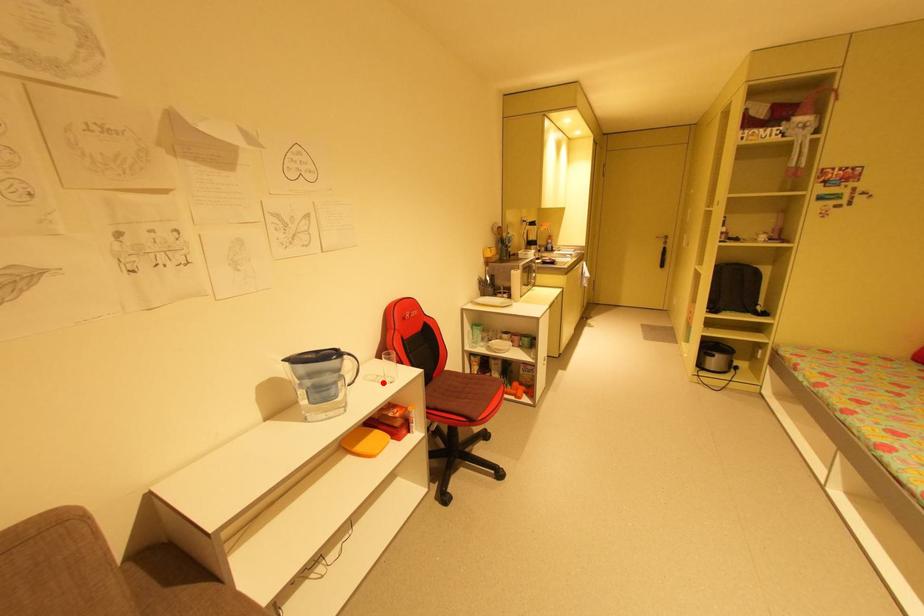
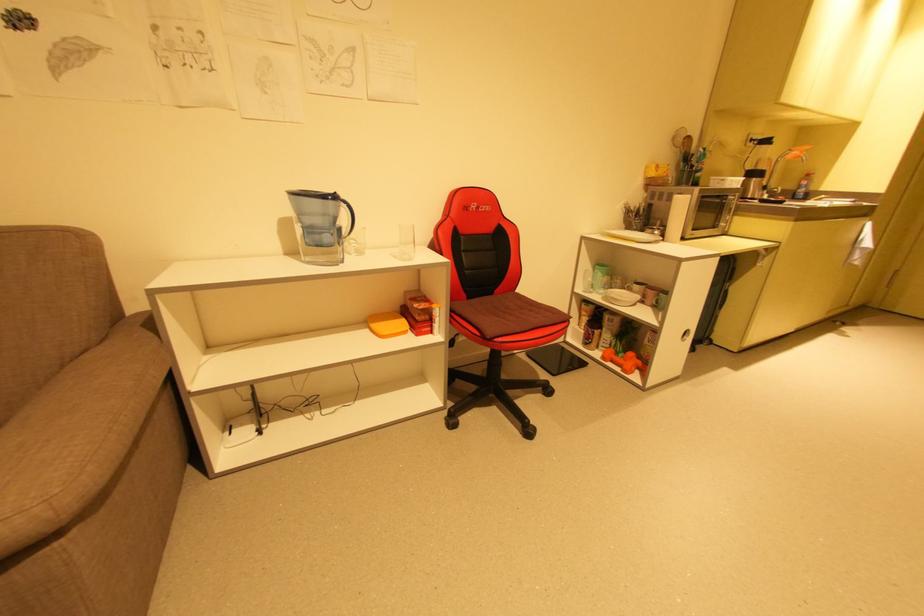
Question: A red point is marked in image1. In image2, is the corresponding 3D point closer to the camera or farther? Reply with the corresponding letter.

Choices:
 (A) The corresponding 3D point is closer.
 (B) The corresponding 3D point is farther.

Answer: (A)